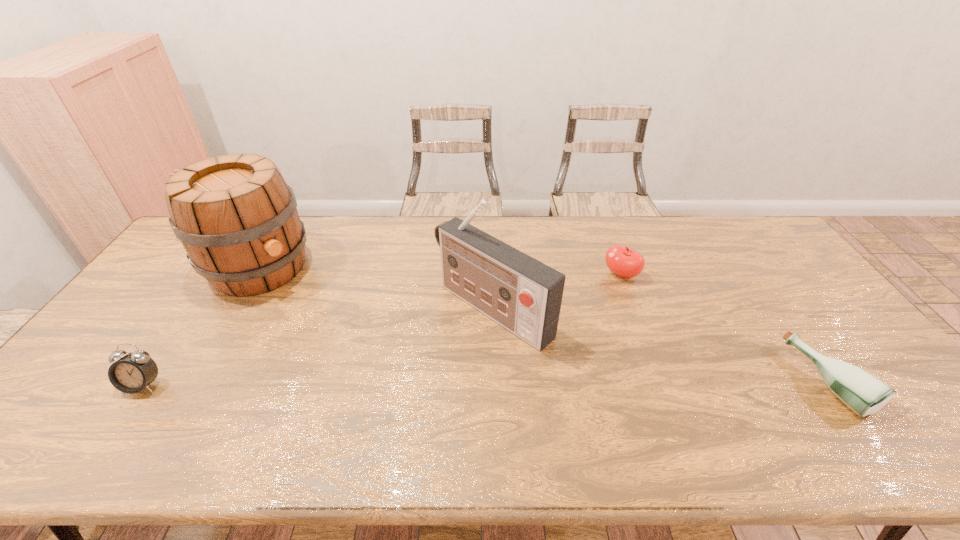
This screenshot has height=540, width=960. What are the coordinates of `vacant space located on the side of the cider where the spigot is located` in the screenshot? It's located at (338, 329).

At what (x,y) coordinates should I click in order to perform the action: click on free space located on the side of the cider where the spigot is located. Please return your answer as a coordinate pair (x, y). The width and height of the screenshot is (960, 540). Looking at the image, I should click on (360, 347).

Identify the location of blank area located on the side of the cider where the spigot is located. (298, 297).

The image size is (960, 540). In order to click on free region located 0.220m on the front panel of the radio receiver in this screenshot , I will do `click(387, 390)`.

Image resolution: width=960 pixels, height=540 pixels. I want to click on free location located on the front panel of the radio receiver, so click(373, 400).

Where is `free space located on the front panel of the radio receiver`? The image size is (960, 540). free space located on the front panel of the radio receiver is located at coordinates (426, 359).

Locate an element on the screen. object that is at the far edge is located at coordinates (237, 220).

Find the location of a particular element. alarm clock that is positioned at the near edge is located at coordinates (132, 373).

You are a GUI agent. You are given a task and a screenshot of the screen. Output one action in this format:
    pyautogui.click(x=<x>, y=<y>)
    Task: Click on the bottle located at the near edge
    Image resolution: width=960 pixels, height=540 pixels.
    Given the screenshot: What is the action you would take?
    pyautogui.click(x=863, y=393)

This screenshot has width=960, height=540. Identify the location of alarm clock present at the left edge. (132, 373).